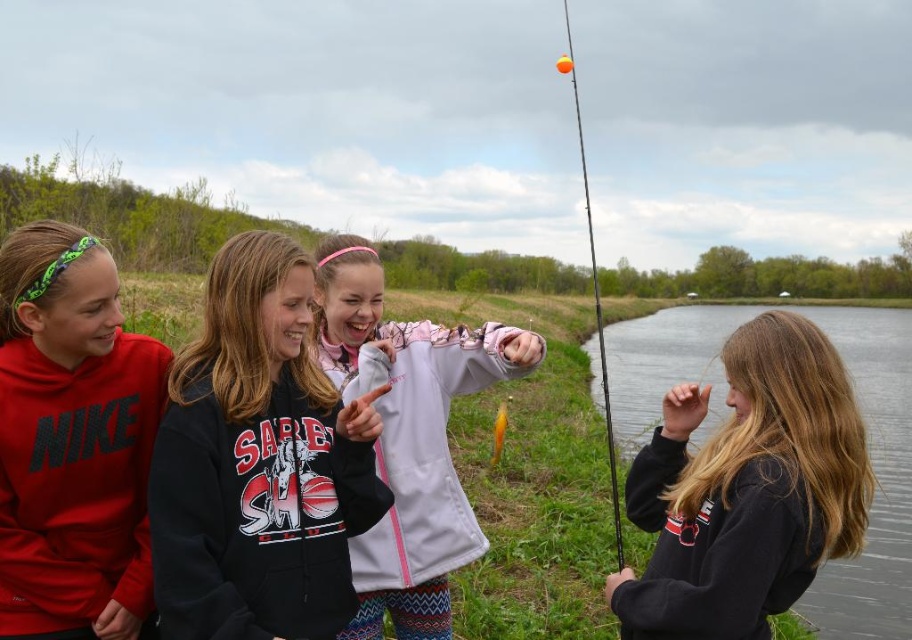
Is the position of white fleece jacket at center less distant than that of orange glossy fishing pole at upper right?

Yes, white fleece jacket at center is closer to the viewer.

Which is above, white fleece jacket at center or orange glossy fishing pole at upper right?

orange glossy fishing pole at upper right

Is point (468, 378) positioned behind point (593, 294)?

No.

This screenshot has height=640, width=912. In order to click on white fleece jacket at center in this screenshot , I will do `click(409, 436)`.

Does black fleece sweatshirt at center appear on the left side of orange glossy fishing pole at upper right?

Correct, you'll find black fleece sweatshirt at center to the left of orange glossy fishing pole at upper right.

In the scene shown: Measure the distance between point (x=182, y=612) and camera.

A distance of 6.77 feet exists between point (x=182, y=612) and camera.

I want to click on black fleece sweatshirt at center, so click(258, 464).

Which is in front, point (53, 253) or point (342, 296)?

Point (53, 253)

Which of these two, matte red hoodie at left or white fleece jacket at center, stands taller?

With more height is white fleece jacket at center.

Is point (40, 444) in front of point (426, 604)?

Yes, it is in front of point (426, 604).

Locate an element on the screen. The width and height of the screenshot is (912, 640). matte red hoodie at left is located at coordinates (71, 442).